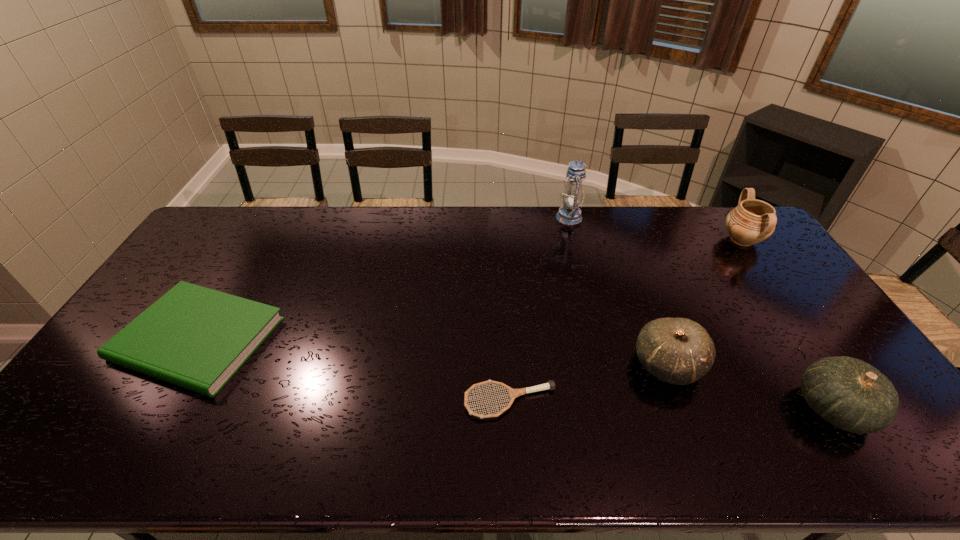
This screenshot has width=960, height=540. Find the location of `empty space between the fifth object from right to left and the right gourd`. empty space between the fifth object from right to left and the right gourd is located at coordinates (672, 404).

In order to click on unoccupied area between the third object from right to left and the tallest object in this screenshot , I will do `click(618, 291)`.

The width and height of the screenshot is (960, 540). What are the coordinates of `vacant area that lies between the urn and the tennis racket` in the screenshot? It's located at (626, 321).

Image resolution: width=960 pixels, height=540 pixels. I want to click on vacant area that lies between the urn and the right gourd, so click(788, 324).

The image size is (960, 540). Find the location of `vacant area that lies between the fifth object from right to left and the paperback book`. vacant area that lies between the fifth object from right to left and the paperback book is located at coordinates (354, 370).

Identify the location of empty space between the right gourd and the paperback book. (516, 373).

I want to click on free space between the third object from right to left and the urn, so click(x=705, y=302).

You are a GUI agent. You are given a task and a screenshot of the screen. Output one action in this format:
    pyautogui.click(x=<x>, y=<y>)
    Task: Click on the free spot between the paperback book and the right gourd
    This screenshot has height=540, width=960.
    Given the screenshot: What is the action you would take?
    pyautogui.click(x=516, y=373)

At what (x,y) coordinates should I click in order to perform the action: click on object that is the fifth closest one to the tennis racket. Please return your answer as a coordinate pair (x, y). Image resolution: width=960 pixels, height=540 pixels. Looking at the image, I should click on (752, 221).

Identify which object is the third closest to the urn. Please provide its 2D coordinates. Your answer should be formatted as a tuple, i.e. [(x, y)], where the tuple contains the x and y coordinates of a point satisfying the conditions above.

[(850, 394)]